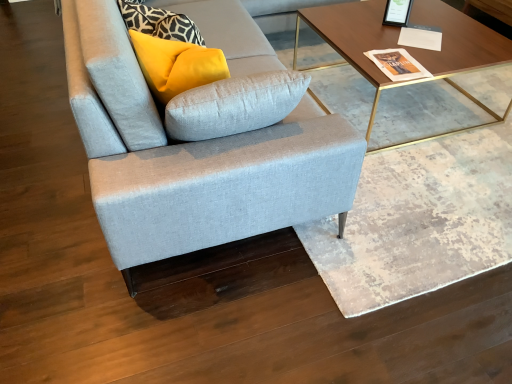
Identify the location of free space to the left of light gray fabric couch at center. (38, 131).